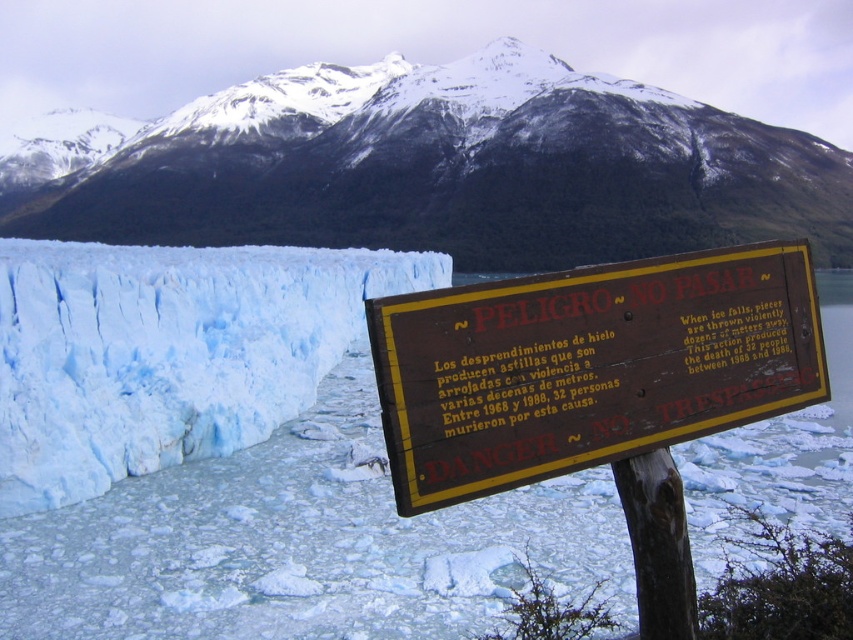
Question: Which object is positioned farthest from the brown wooden sign at center?

Choices:
 (A) snowy rock mountain at upper center
 (B) blue ice glacier at left

Answer: (A)

Question: In this image, where is snowy rock mountain at upper center located relative to blue ice glacier at left?

Choices:
 (A) above
 (B) below

Answer: (A)

Question: Is the position of brown wooden sign at center less distant than that of blue ice glacier at left?

Choices:
 (A) yes
 (B) no

Answer: (A)

Question: Which object is farther from the camera taking this photo?

Choices:
 (A) blue ice glacier at left
 (B) brown wooden sign at center

Answer: (A)

Question: Among these objects, which one is farthest from the camera?

Choices:
 (A) blue ice glacier at left
 (B) brown wooden sign at center
 (C) snowy rock mountain at upper center

Answer: (C)

Question: Is brown wooden sign at center above blue ice glacier at left?

Choices:
 (A) no
 (B) yes

Answer: (A)